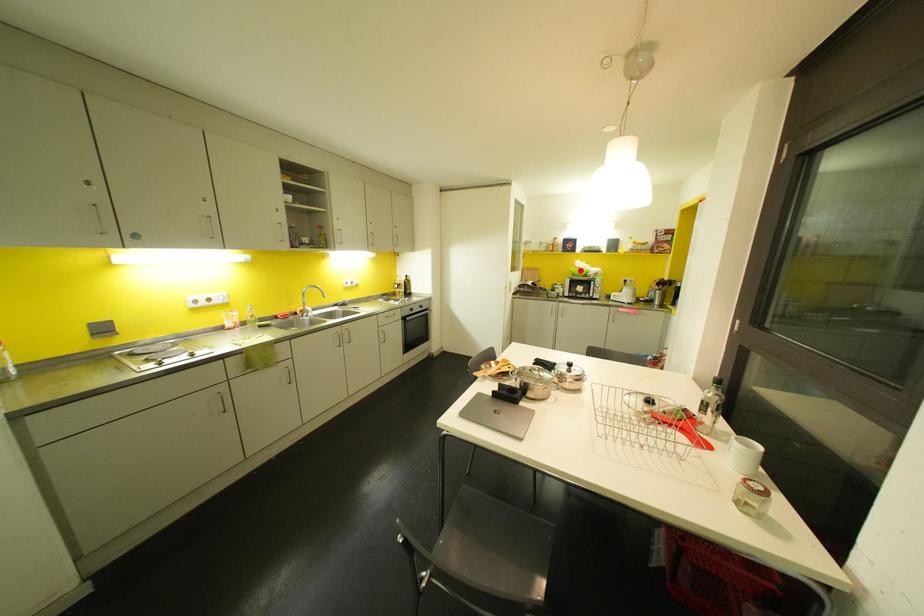
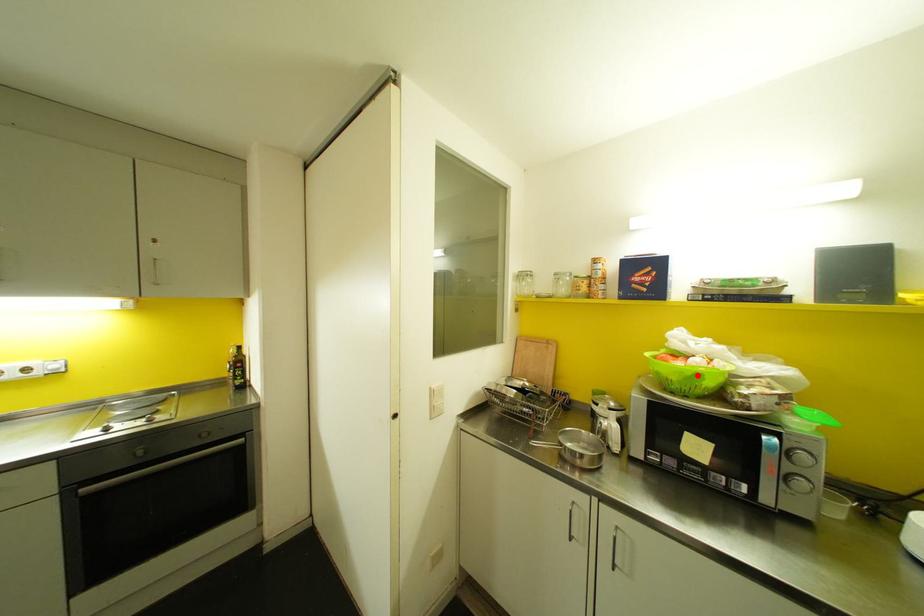
I am providing you with two images of the same scene from different viewpoints. A red point is marked on the first image and another point is marked on the second image. Do the highlighted points in image1 and image2 indicate the same real-world spot?

Yes